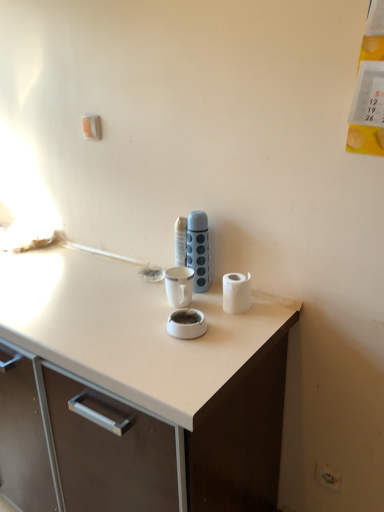
Question: From a real-world perspective, is white plastic electric outlet at lower right under blue textured thermos at center?

Choices:
 (A) no
 (B) yes

Answer: (B)

Question: Is white plastic electric outlet at lower right closer to the viewer compared to blue textured thermos at center?

Choices:
 (A) yes
 (B) no

Answer: (B)

Question: Is white plastic electric outlet at lower right located outside blue textured thermos at center?

Choices:
 (A) yes
 (B) no

Answer: (A)

Question: Is white plastic electric outlet at lower right turned away from blue textured thermos at center?

Choices:
 (A) no
 (B) yes

Answer: (A)

Question: Can you confirm if white plastic electric outlet at lower right is taller than blue textured thermos at center?

Choices:
 (A) yes
 (B) no

Answer: (B)

Question: From their relative heights in the image, would you say blue textured thermos at center is taller or shorter than white matte paper towel at right?

Choices:
 (A) tall
 (B) short

Answer: (A)

Question: Is blue textured thermos at center in front of or behind white matte paper towel at right in the image?

Choices:
 (A) front
 (B) behind

Answer: (B)

Question: From a real-world perspective, is blue textured thermos at center above or below white matte paper towel at right?

Choices:
 (A) below
 (B) above

Answer: (B)

Question: Based on their positions, is blue textured thermos at center located to the left or right of white matte paper towel at right?

Choices:
 (A) right
 (B) left

Answer: (B)

Question: Is blue textured thermos at center situated inside white plastic electric outlet at lower right or outside?

Choices:
 (A) inside
 (B) outside

Answer: (B)

Question: Based on their sizes in the image, would you say blue textured thermos at center is bigger or smaller than white plastic electric outlet at lower right?

Choices:
 (A) small
 (B) big

Answer: (B)

Question: From a real-world perspective, is blue textured thermos at center positioned above or below white plastic electric outlet at lower right?

Choices:
 (A) below
 (B) above

Answer: (B)

Question: Is blue textured thermos at center taller or shorter than white plastic electric outlet at lower right?

Choices:
 (A) tall
 (B) short

Answer: (A)

Question: Considering the positions of white matte paper towel at right and blue textured thermos at center in the image, is white matte paper towel at right wider or thinner than blue textured thermos at center?

Choices:
 (A) thin
 (B) wide

Answer: (B)

Question: Is point (228, 296) closer or farther from the camera than point (188, 227)?

Choices:
 (A) farther
 (B) closer

Answer: (B)